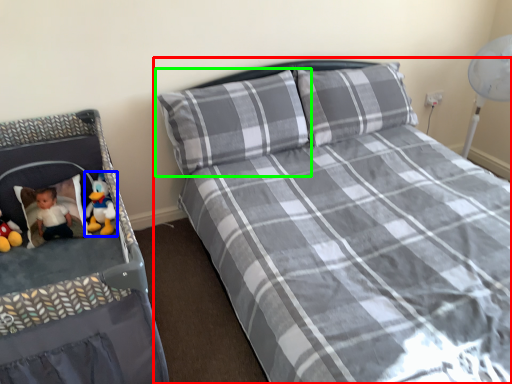
Question: Based on their relative distances, which object is nearer to bed (highlighted by a red box)? Choose from toy (highlighted by a blue box) and pillow (highlighted by a green box).

Choices:
 (A) toy
 (B) pillow

Answer: (B)